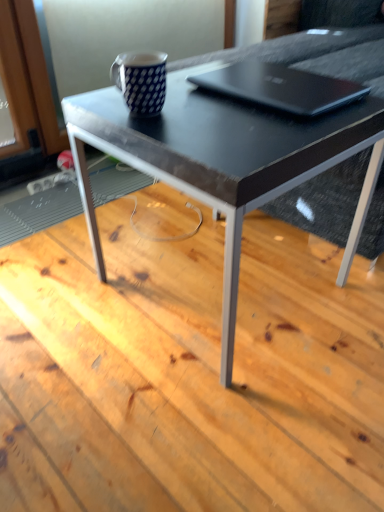
Question: Considering the positions of blue dotted mug at upper center and black matte laptop at upper center in the image, is blue dotted mug at upper center bigger or smaller than black matte laptop at upper center?

Choices:
 (A) big
 (B) small

Answer: (B)

Question: Considering their positions, is blue dotted mug at upper center located in front of or behind black matte laptop at upper center?

Choices:
 (A) behind
 (B) front

Answer: (B)

Question: Which is nearer to the blue dotted mug at upper center?

Choices:
 (A) black glossy table at center
 (B) blue dotted mug at upper center
 (C) black matte laptop at upper center

Answer: (A)

Question: Based on their relative distances, which object is nearer to the blue dotted mug at upper center?

Choices:
 (A) blue dotted mug at upper center
 (B) black matte laptop at upper center
 (C) black glossy table at center

Answer: (B)